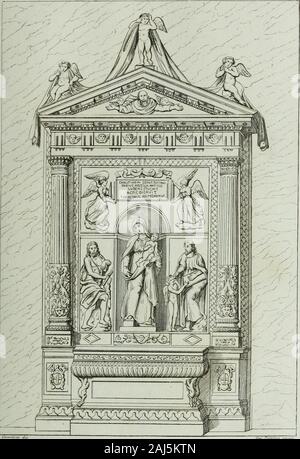
Where is `sash`? The image size is (300, 459). sash is located at coordinates pyautogui.click(x=268, y=134), pyautogui.click(x=166, y=53), pyautogui.click(x=131, y=52), pyautogui.click(x=48, y=99).